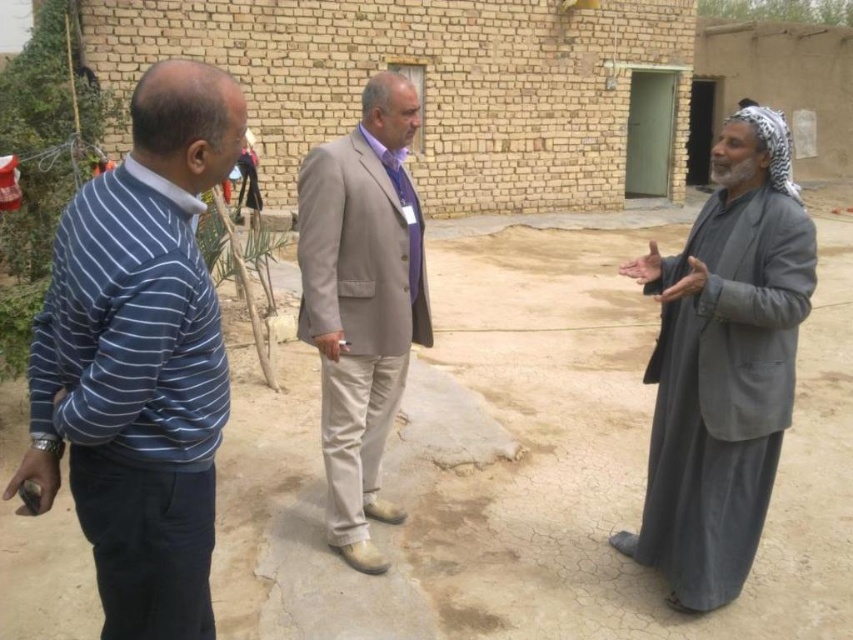
Question: Which point appears farthest from the camera in this image?

Choices:
 (A) (715, 433)
 (B) (618, 465)

Answer: (B)

Question: Can you confirm if dull brown dirt at center is positioned to the right of blue striped sweater at left?

Choices:
 (A) yes
 (B) no

Answer: (A)

Question: Based on their relative distances, which object is farther from the beige fabric suit at center?

Choices:
 (A) dull brown dirt at center
 (B) blue striped sweater at left
 (C) gray woolen robe at right

Answer: (A)

Question: Does blue striped sweater at left have a lesser width compared to beige fabric suit at center?

Choices:
 (A) yes
 (B) no

Answer: (B)

Question: Considering the relative positions of dull brown dirt at center and beige fabric suit at center in the image provided, where is dull brown dirt at center located with respect to beige fabric suit at center?

Choices:
 (A) below
 (B) above

Answer: (A)

Question: Which object appears closest to the camera in this image?

Choices:
 (A) blue striped sweater at left
 (B) beige fabric suit at center

Answer: (A)